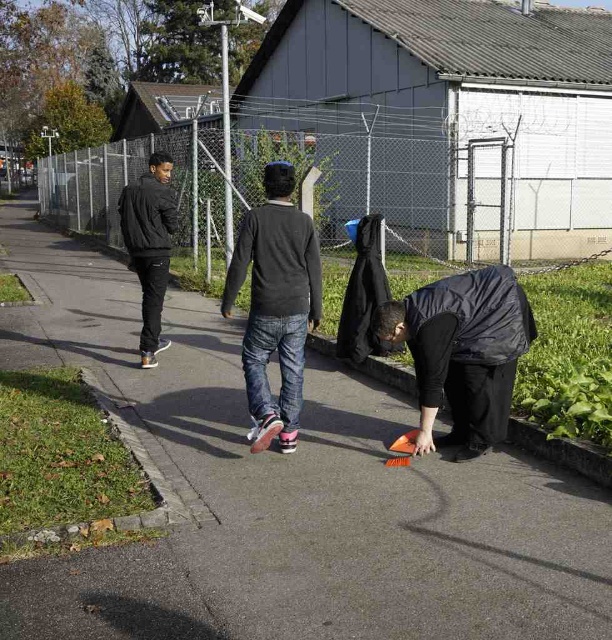
Question: Is black matte jacket at lower right above dark gray sweater at center?

Choices:
 (A) yes
 (B) no

Answer: (B)

Question: Which of these objects is positioned farthest from the dark gray sweater at center?

Choices:
 (A) black matte jacket at lower right
 (B) black matte jacket at left

Answer: (B)

Question: Does smooth asphalt pavement at center appear over black matte jacket at lower right?

Choices:
 (A) no
 (B) yes

Answer: (A)

Question: Which object is positioned closest to the smooth asphalt pavement at center?

Choices:
 (A) black matte jacket at left
 (B) black matte jacket at lower right
 (C) dark gray sweater at center

Answer: (B)

Question: Among these points, which one is farthest from the camera?

Choices:
 (A) (143, 257)
 (B) (338, 515)
 (C) (242, 346)
 (D) (441, 288)

Answer: (A)

Question: Where is black matte jacket at lower right located in relation to black matte jacket at left in the image?

Choices:
 (A) right
 (B) left

Answer: (A)